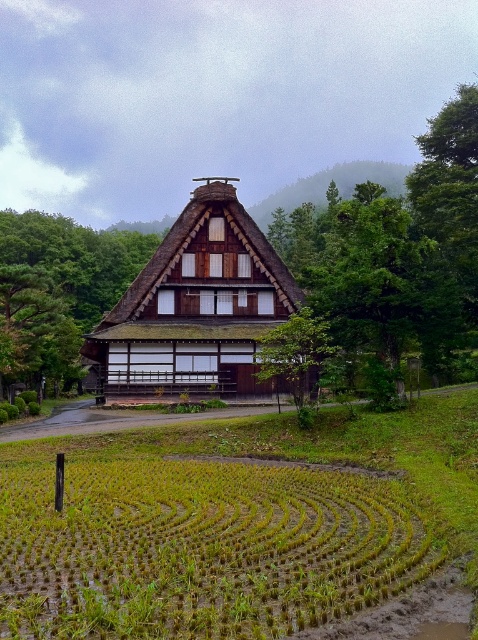
You are standing in front of the traditional Japanese house and want to walk to the green leafy hillside at upper center. Which direction should you move relative to the green grassy rice field at lower center?

The green grassy rice field at lower center is closer to the viewer than the green leafy hillside at upper center. To reach the hillside, you should move away from the rice field towards the upper center direction.

You are standing in the rice paddy field in front of the traditional Japanese house. You see a point marked at coordinates (197,307). According to the image, where is this point located?

The point marked at coordinates (197,307) is located on the thatched roof hut at center.